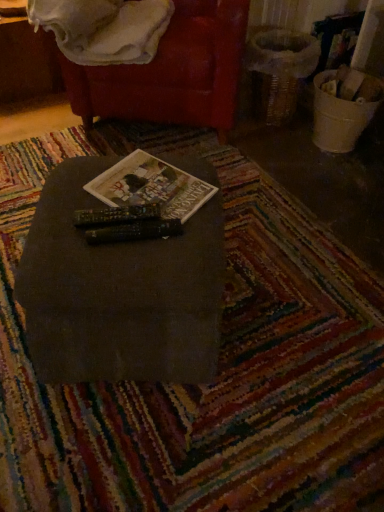
This screenshot has width=384, height=512. I want to click on free space above hardcover book at center (from a real-world perspective), so click(155, 184).